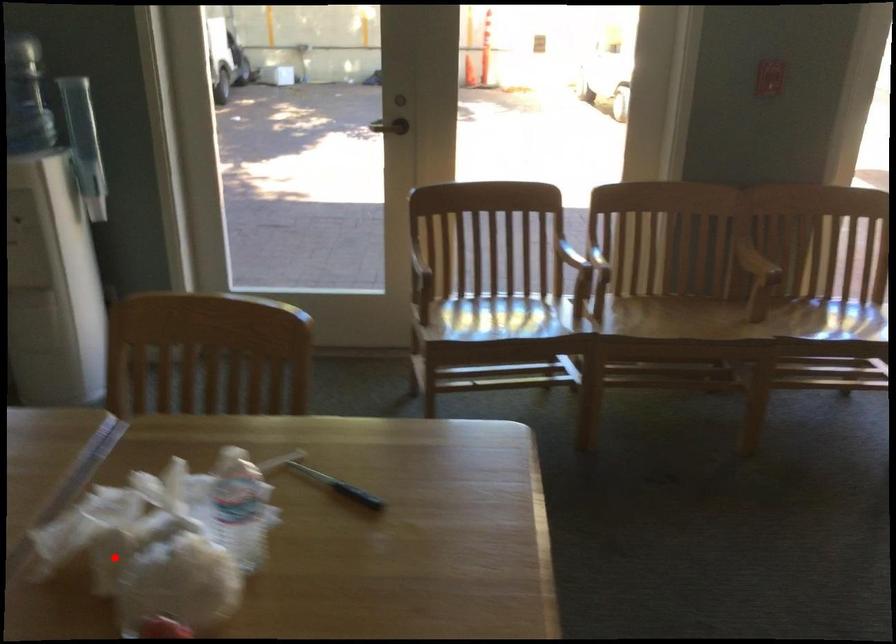
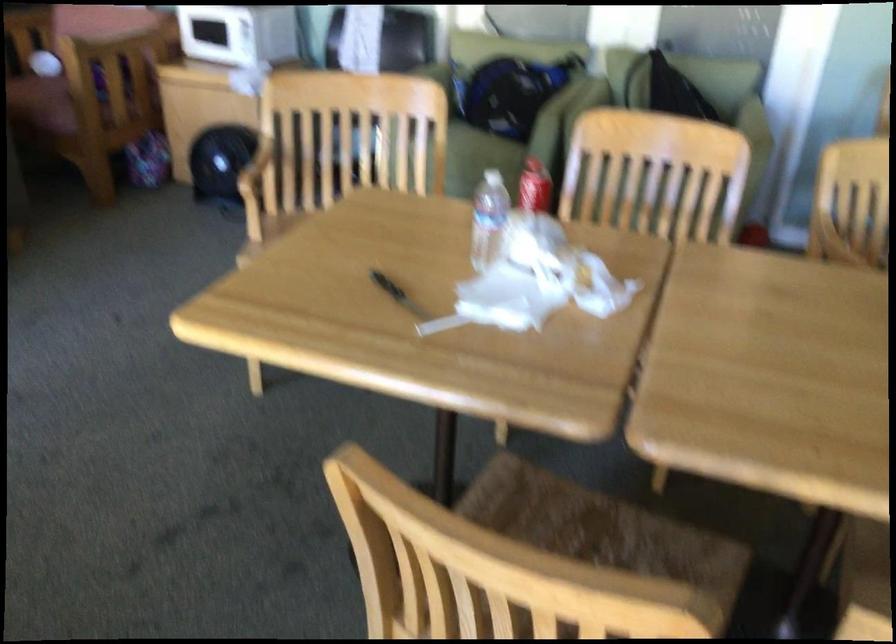
Question: I am providing you with two images of the same scene from different viewpoints. In image1, a red point is highlighted. Considering the same 3D point in image2, which of the following is correct?

Choices:
 (A) It is closer
 (B) It is farther

Answer: (B)